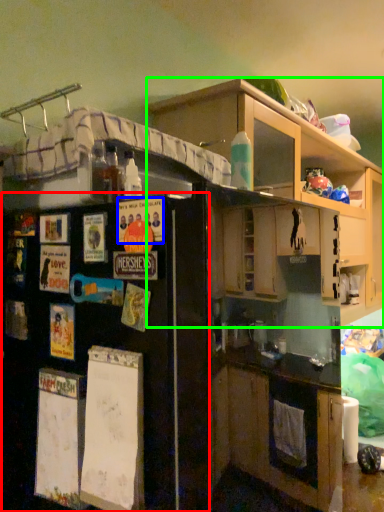
Question: Which object is positioned closest to refrigerator (highlighted by a red box)? Select from poster (highlighted by a blue box) and cabinetry (highlighted by a green box).

Choices:
 (A) poster
 (B) cabinetry

Answer: (A)